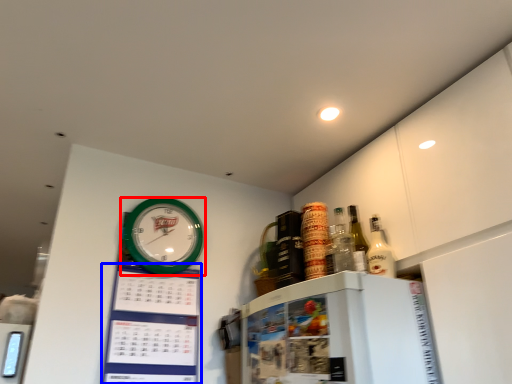
Question: Which object appears farthest to the camera in this image, wall clock (highlighted by a red box) or bulletin board (highlighted by a blue box)?

Choices:
 (A) wall clock
 (B) bulletin board

Answer: (A)